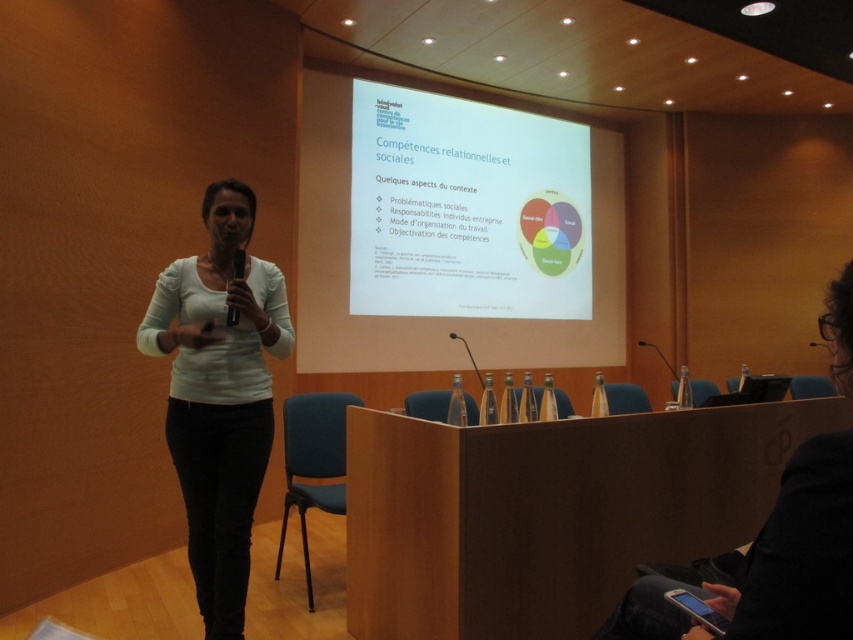
Question: Estimate the real-world distances between objects in this image. Which object is closer to the black fabric jacket at lower right?

Choices:
 (A) white matte shirt at center
 (B) white matte projection screen at upper center

Answer: (A)

Question: Which point appears farthest from the camera in this image?

Choices:
 (A) (834, 573)
 (B) (265, 440)

Answer: (B)

Question: Which point appears closest to the camera in this image?

Choices:
 (A) (271, 307)
 (B) (315, 278)
 (C) (838, 298)

Answer: (C)

Question: Does white matte shirt at center appear on the left side of white matte projection screen at upper center?

Choices:
 (A) no
 (B) yes

Answer: (B)

Question: From the image, what is the correct spatial relationship of white matte projection screen at upper center in relation to black fabric jacket at lower right?

Choices:
 (A) below
 (B) above

Answer: (B)

Question: Does white matte shirt at center have a lesser width compared to black fabric jacket at lower right?

Choices:
 (A) yes
 (B) no

Answer: (A)